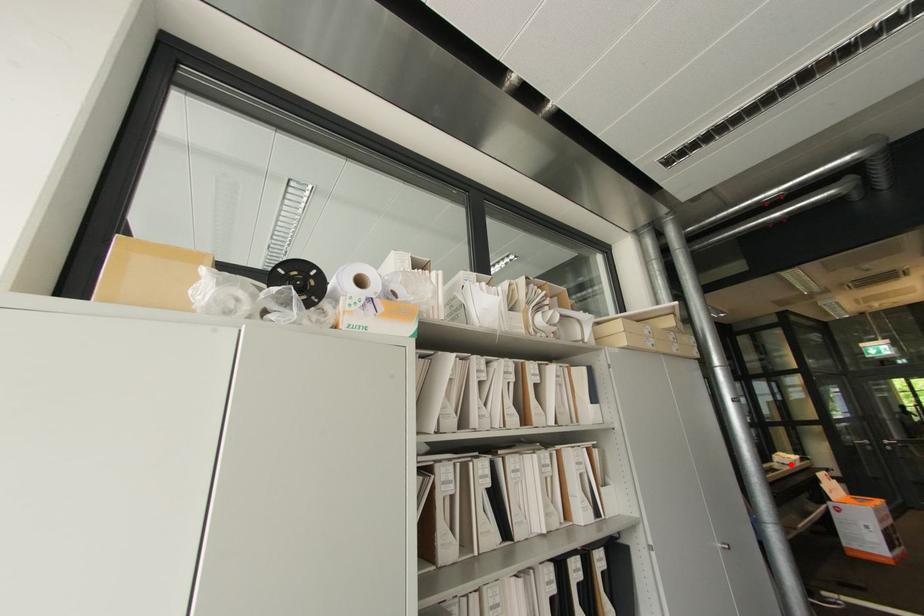
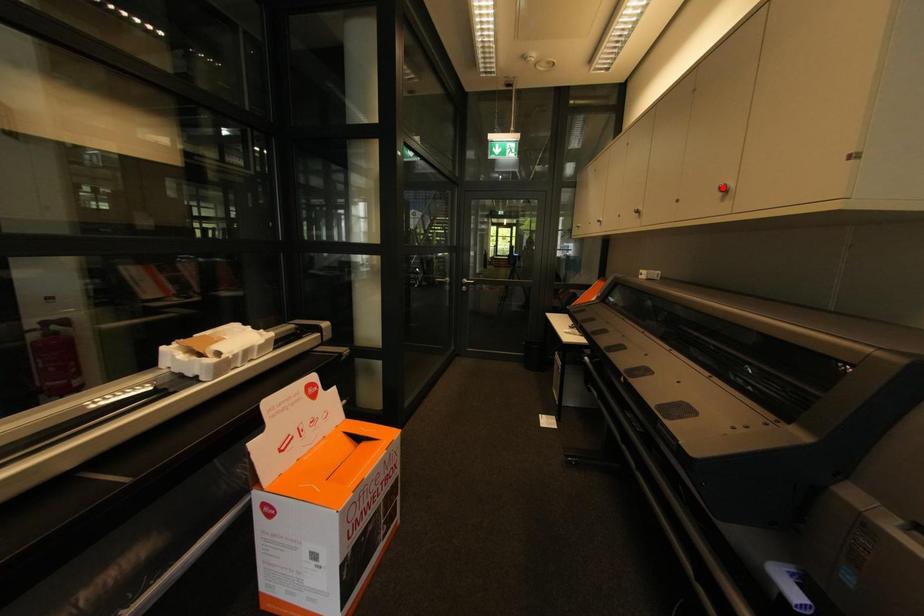
In the scene shown: I am providing you with two images of the same scene from different viewpoints. A red point is marked on the first image and another point is marked on the second image. Is the red point in image1 aligned with the point shown in image2?

No